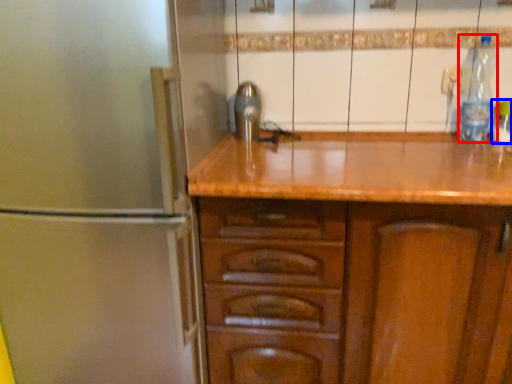
Question: Which point is closer to the camera, bottle (highlighted by a red box) or bottle (highlighted by a blue box)?

Choices:
 (A) bottle
 (B) bottle

Answer: (A)